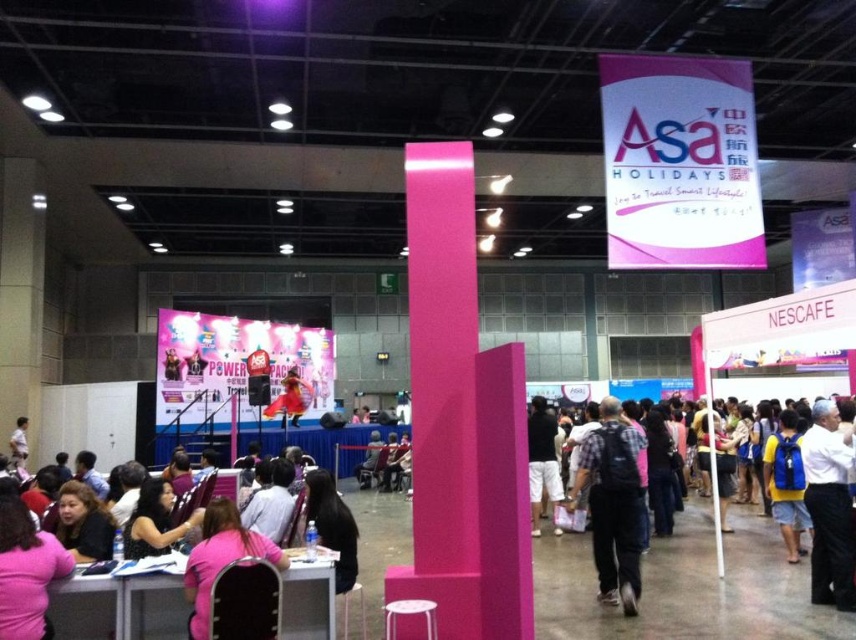
You are an event planner trying to locate two items in the image. You need to know which item is taller between the plaid fabric shirt at center and the blue backpack at right. Can you help?

The plaid fabric shirt at center is much taller than the blue backpack at right, so the plaid fabric shirt at center is taller.

You are organizing a photo shoot in this event space and need to position two props. The first prop must be placed where the plaid fabric shirt at center is currently located, and the second prop must be placed where the blue backpack at right is. Based on their current positions, which prop will be closer to the right side of the image?

The blue backpack at right is positioned on the right side of the plaid fabric shirt at center, so the prop placed where the blue backpack at right is will be closer to the right side of the image.

You are organizing a photo shoot in the event space and need to position the pink fabric shirt at lower left and the pink fabric chair at lower left. Since space is limited, which object should you move to accommodate more items?

The pink fabric shirt at lower left should be moved because it occupies less space than the pink fabric chair at lower left, making it easier to relocate without taking up too much additional space.